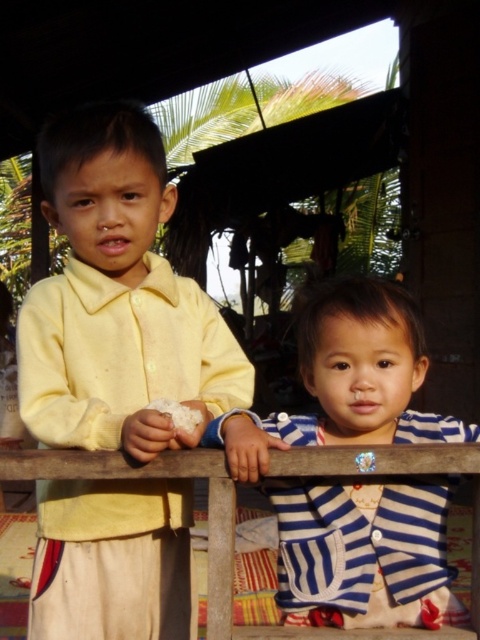
You are a photographer trying to capture a photo of the blue striped shirt at center and the wooden at center. Based on their heights, which object should you focus on first if you want to ensure both are in frame without moving the camera?

The blue striped shirt at center is taller than the wooden at center, so you should focus on the blue striped shirt at center first to ensure both are in frame.

You are a photographer trying to capture a photo of the blue striped shirt at center and the wooden at center. Since you want both subjects in focus, you need to know their positions relative to each other. Which one is positioned to the right side of the other?

The blue striped shirt at center is to the right of wooden at center, so the blue striped shirt at center is positioned to the right side of the wooden at center.